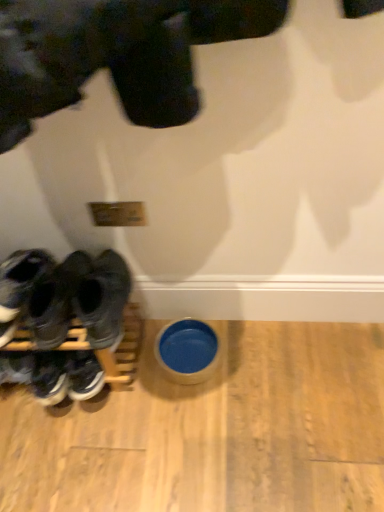
Question: From the image's perspective, is dark gray suede sneakers at left, the second footwear viewed from the right, beneath black leather sneakers at left, which is counted as the 1th footwear, starting from the left?

Choices:
 (A) yes
 (B) no

Answer: (B)

Question: Is dark gray suede sneakers at left, the second footwear viewed from the right, to the right of black leather sneakers at left, which is counted as the 1th footwear, starting from the left, from the viewer's perspective?

Choices:
 (A) yes
 (B) no

Answer: (A)

Question: Does dark gray suede sneakers at left, the second footwear viewed from the right, come behind black leather sneakers at left, which is the third footwear from right to left?

Choices:
 (A) no
 (B) yes

Answer: (A)

Question: Is dark gray suede sneakers at left, the second footwear viewed from the right, completely or partially outside of black leather sneakers at left, which is counted as the 1th footwear, starting from the left?

Choices:
 (A) yes
 (B) no

Answer: (A)

Question: From the image's perspective, does dark gray suede sneakers at left, the second footwear from the left, appear higher than black leather sneakers at left, which is counted as the 1th footwear, starting from the left?

Choices:
 (A) no
 (B) yes

Answer: (B)

Question: Is dark gray suede sneakers at left, the second footwear from the left, inside or outside of black rubber shoes at left, which is the 1th footwear in right-to-left order?

Choices:
 (A) inside
 (B) outside

Answer: (B)

Question: From a real-world perspective, is dark gray suede sneakers at left, the second footwear from the left, above or below black rubber shoes at left, which is the 1th footwear in right-to-left order?

Choices:
 (A) above
 (B) below

Answer: (B)

Question: Considering the positions of point (6, 310) and point (100, 342), is point (6, 310) closer or farther from the camera than point (100, 342)?

Choices:
 (A) farther
 (B) closer

Answer: (B)

Question: Looking at their shapes, would you say dark gray suede sneakers at left, the second footwear viewed from the right, is wider or thinner than black rubber shoes at left, which is the 1th footwear in right-to-left order?

Choices:
 (A) wide
 (B) thin

Answer: (B)

Question: Looking at their shapes, would you say black leather sneakers at left, which is counted as the 1th footwear, starting from the left, is wider or thinner than black rubber shoes at left, the 3th footwear viewed from the left?

Choices:
 (A) thin
 (B) wide

Answer: (A)

Question: Is point (43, 351) closer or farther from the camera than point (119, 284)?

Choices:
 (A) closer
 (B) farther

Answer: (B)

Question: Is black leather sneakers at left, which is the third footwear from right to left, in front of or behind black rubber shoes at left, the 3th footwear viewed from the left, in the image?

Choices:
 (A) front
 (B) behind

Answer: (B)

Question: In terms of size, does black leather sneakers at left, which is counted as the 1th footwear, starting from the left, appear bigger or smaller than black rubber shoes at left, which is the 1th footwear in right-to-left order?

Choices:
 (A) big
 (B) small

Answer: (A)

Question: From their relative heights in the image, would you say black rubber shoes at left, which is the 1th footwear in right-to-left order, is taller or shorter than blue ceramic bowl at lower center?

Choices:
 (A) short
 (B) tall

Answer: (B)

Question: Would you say black rubber shoes at left, which is the 1th footwear in right-to-left order, is to the left or to the right of blue ceramic bowl at lower center in the picture?

Choices:
 (A) right
 (B) left

Answer: (B)